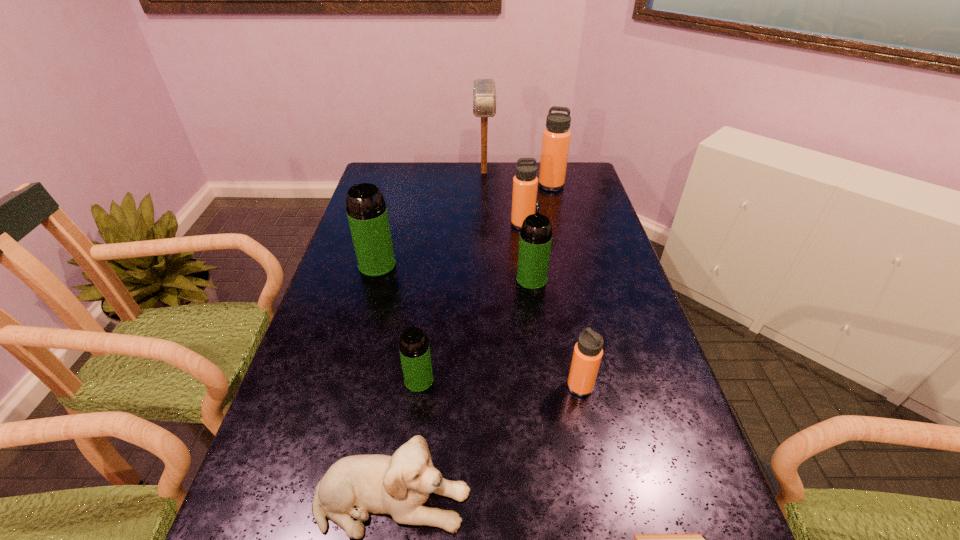
Where is `orange thermos bottle that can be found as the second closest to the biggest green thermos bottle`? orange thermos bottle that can be found as the second closest to the biggest green thermos bottle is located at coordinates (587, 355).